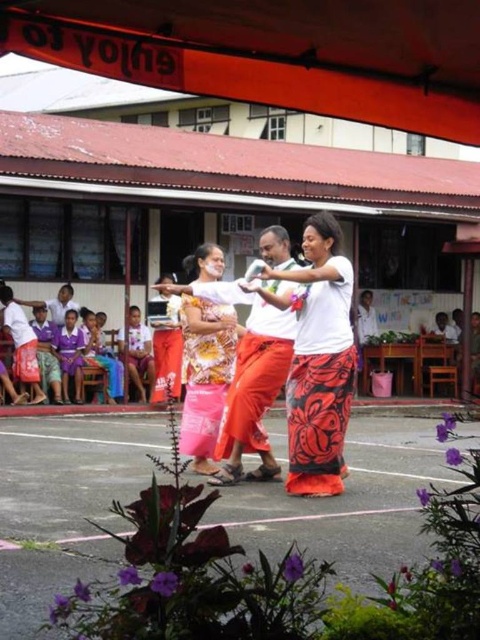
You are a photographer trying to capture the dancers in the scene. You notice the floral woven skirt at center and the patterned fabric dress at center. Which of these two items might require more space in the frame to avoid cropping?

The floral woven skirt at center might be wider than the patterned fabric dress at center, so it might require more space in the frame to avoid cropping.

You are a photographer trying to capture a group photo of the two skirts mentioned. Given that your camera can only focus on objects within a 15 inch range, will you be able to capture both the floral woven skirt at center and the floral fabric skirt at center in the same focused shot?

The floral woven skirt at center and floral fabric skirt at center are 17.55 inches apart from each other, which exceeds the camera focus range of 15 inches. Therefore, both skirts cannot be in focus simultaneously in the same shot.